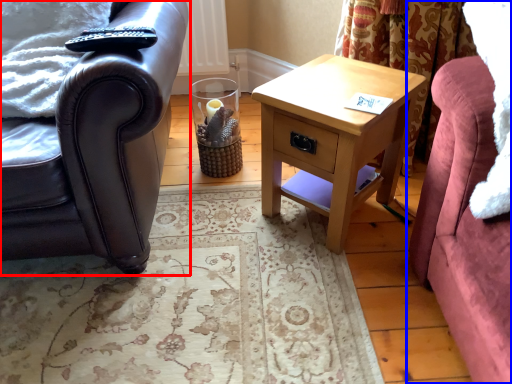
Question: Among these objects, which one is farthest to the camera, chair (highlighted by a red box) or studio couch (highlighted by a blue box)?

Choices:
 (A) chair
 (B) studio couch

Answer: (A)